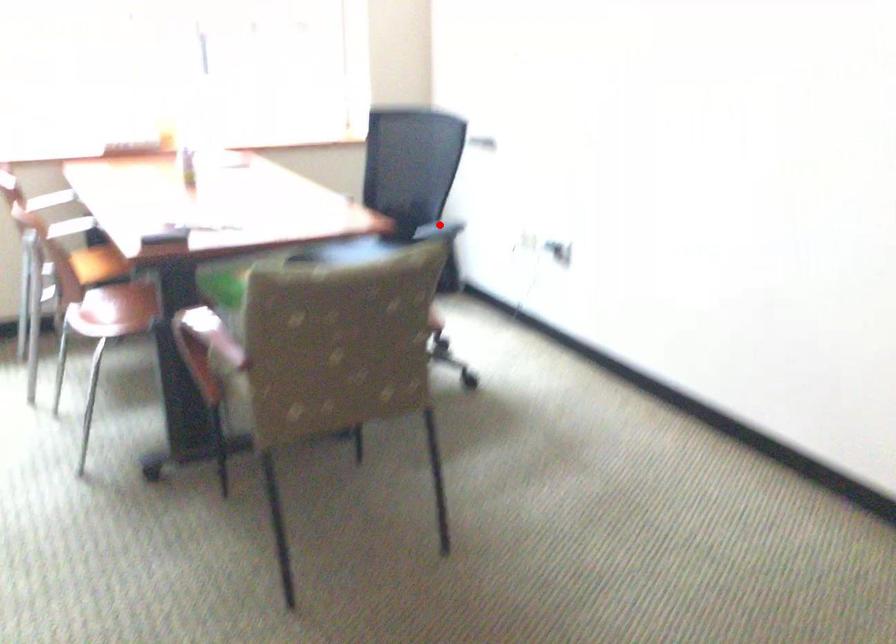
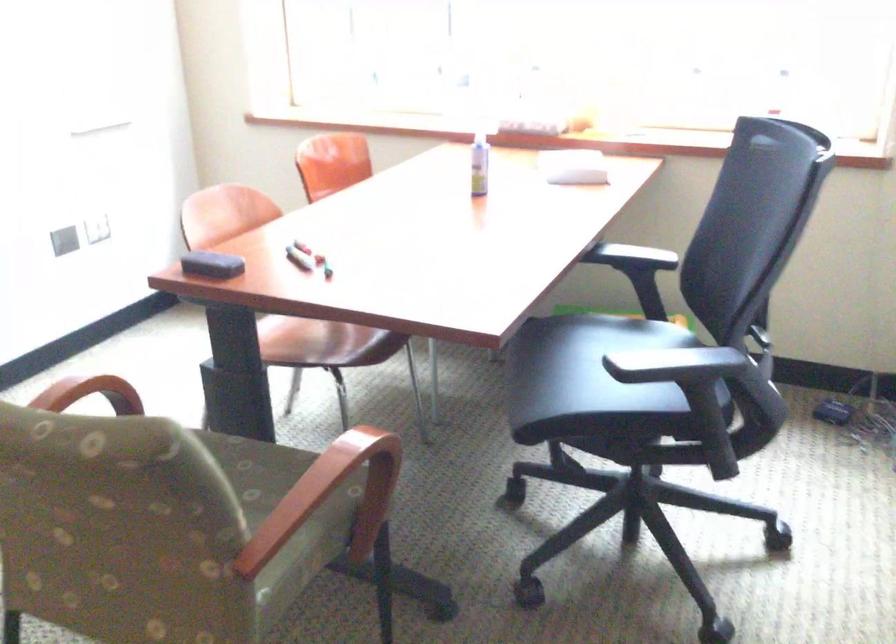
Locate, in the second image, the point that corresponds to the highlighted location in the first image.

(678, 359)